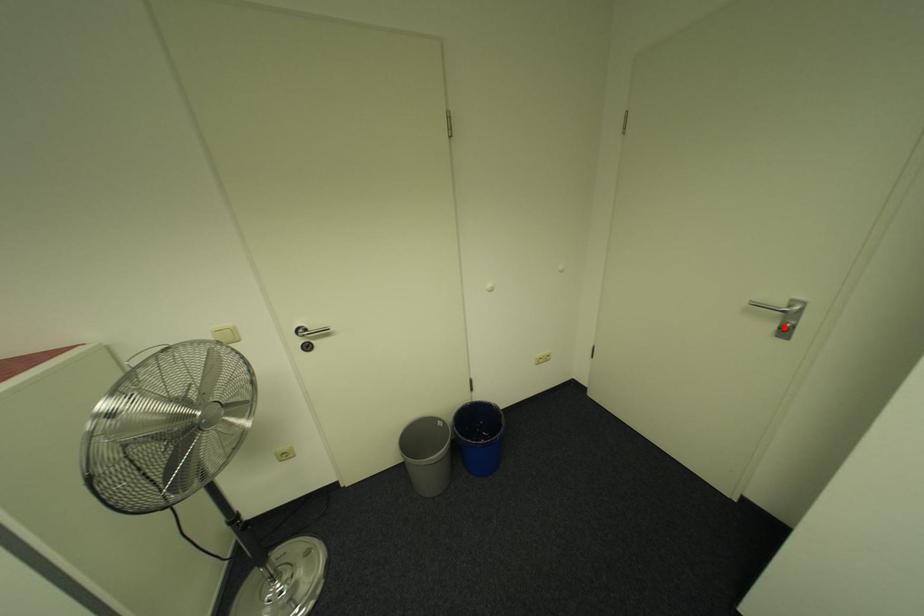
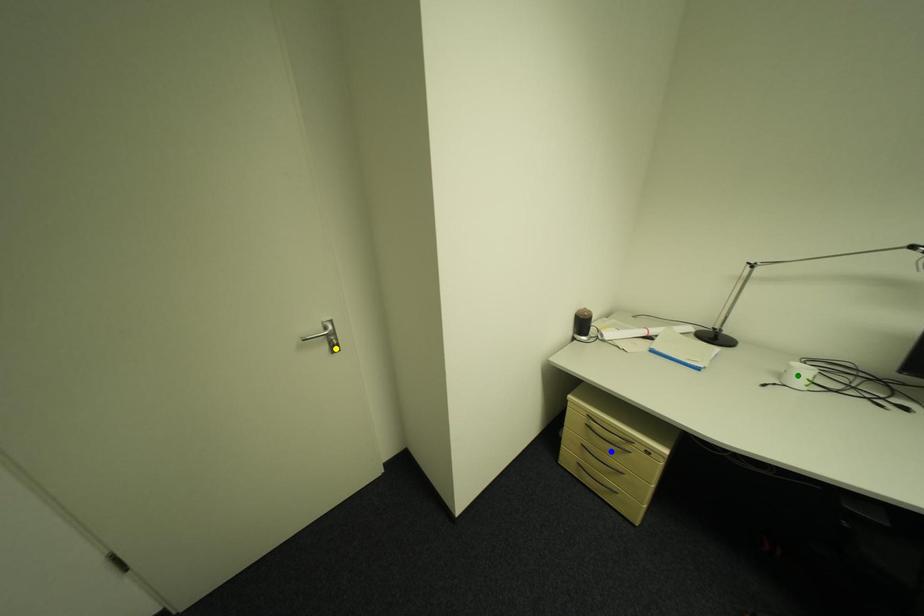
Question: I am providing you with two images of the same scene from different viewpoints. A red point is marked on the first image. You are given multiple points on the second image. Which spot in image 2 lines up with the point in image 1?

Choices:
 (A) blue point
 (B) yellow point
 (C) green point

Answer: (B)